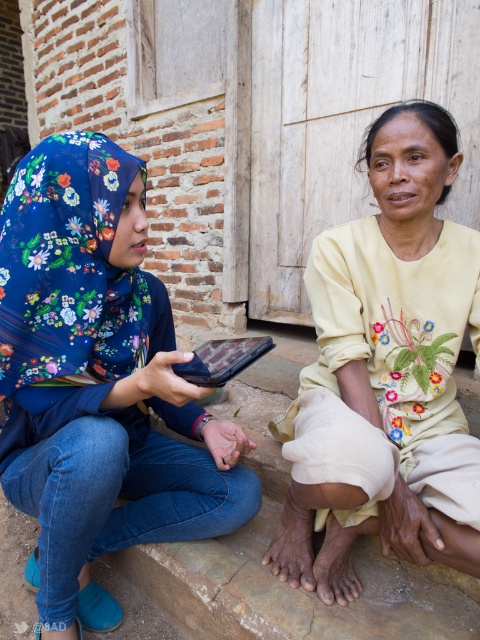
You are designing a display stand for the matte black tablet at center. The stand needs to be slightly smaller than the floral fabric hijab at left to ensure proper visibility. Can the stand be made based on the hijab at left dimensions?

The floral fabric hijab at left is wider than the matte black tablet at center. Therefore, creating a stand slightly smaller than the hijab at left would still accommodate the tablet since the hijab is larger.